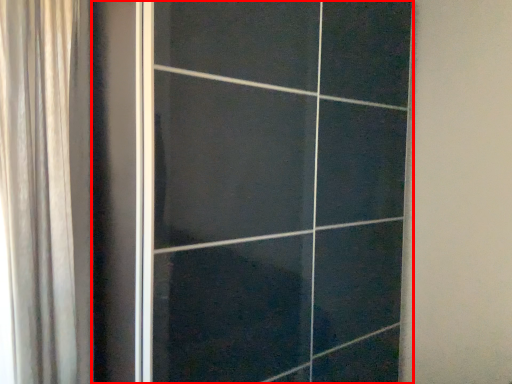
Question: In this image, where is door (annotated by the red box) located relative to curtain?

Choices:
 (A) right
 (B) left

Answer: (A)